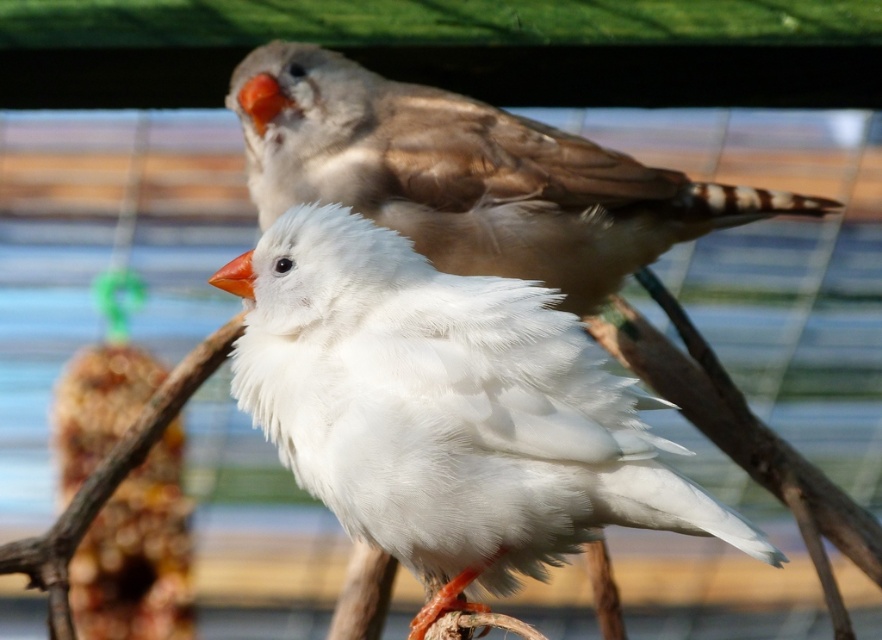
Question: Among these points, which one is farthest from the camera?

Choices:
 (A) (722, 218)
 (B) (288, 381)

Answer: (A)

Question: Is white feathered bird at center below matte brown bird at upper center?

Choices:
 (A) yes
 (B) no

Answer: (A)

Question: Can you confirm if white feathered bird at center is positioned below matte brown bird at upper center?

Choices:
 (A) no
 (B) yes

Answer: (B)

Question: Which object appears closest to the camera in this image?

Choices:
 (A) white feathered bird at center
 (B) matte brown bird at upper center

Answer: (A)

Question: Observing the image, what is the correct spatial positioning of white feathered bird at center in reference to matte brown bird at upper center?

Choices:
 (A) below
 (B) above

Answer: (A)

Question: Which of the following is the farthest from the observer?

Choices:
 (A) click(430, 205)
 (B) click(425, 525)

Answer: (A)